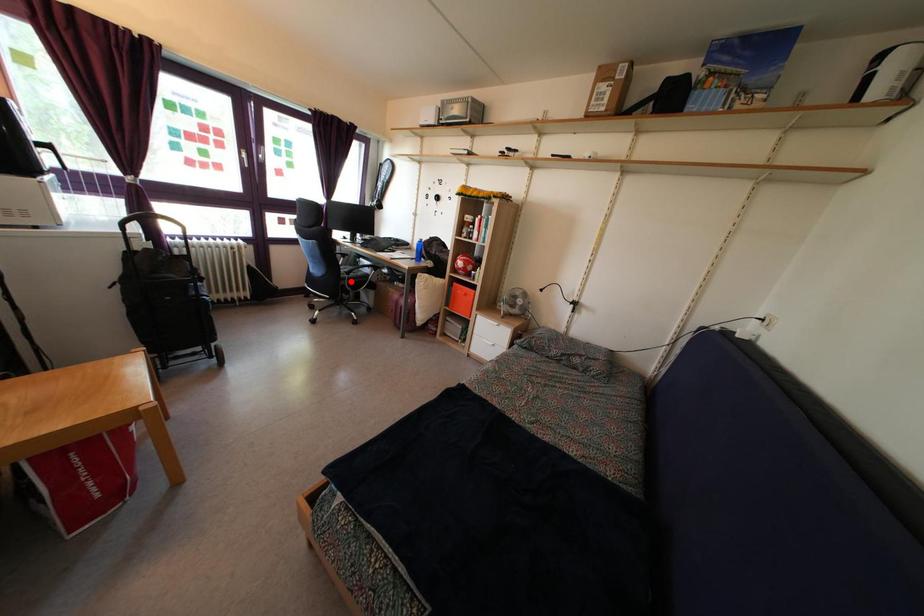
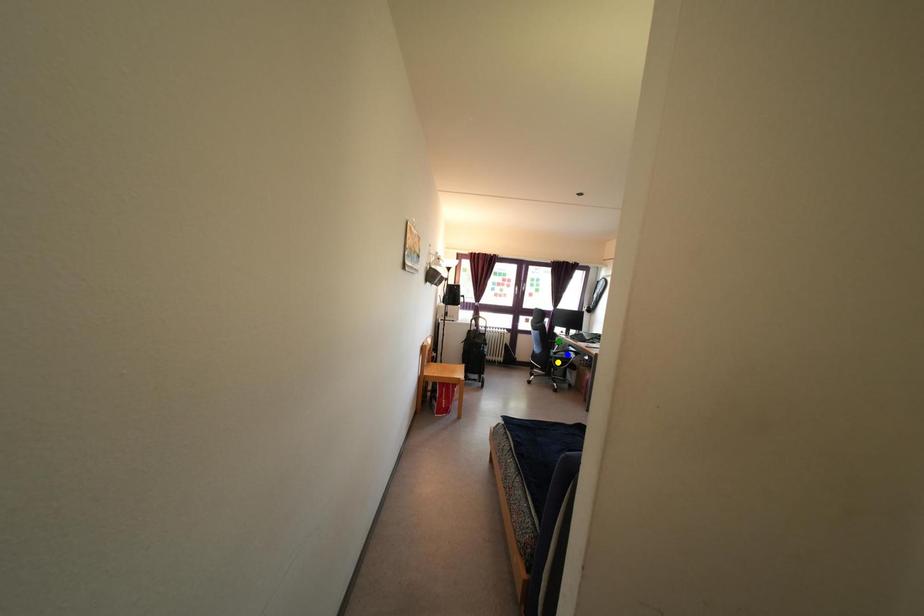
Question: I am providing you with two images of the same scene from different viewpoints. A red point is marked on the first image. You are given multiple points on the second image. Which mark in image 2 goes with the point in image 1?

Choices:
 (A) blue point
 (B) green point
 (C) yellow point

Answer: (C)